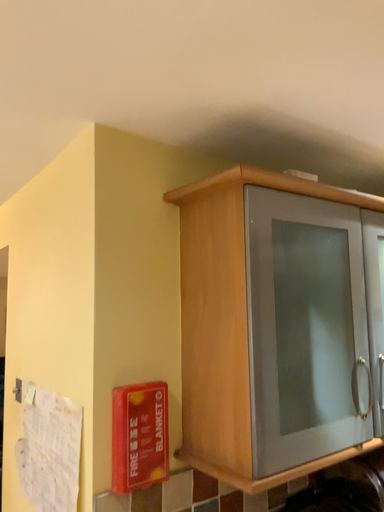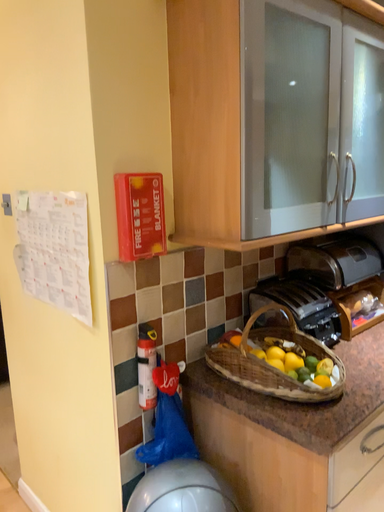
Question: How did the camera likely rotate when shooting the video?

Choices:
 (A) rotated right
 (B) rotated left

Answer: (A)